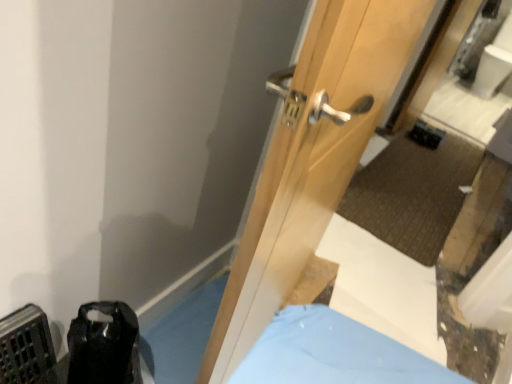
Where is `vacant region to the right of natural wood door at center`? vacant region to the right of natural wood door at center is located at coordinates (321, 349).